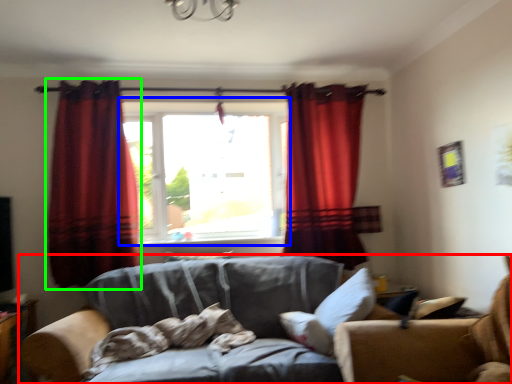
Question: Which is nearer to the studio couch (highlighted by a red box)? window (highlighted by a blue box) or curtain (highlighted by a green box).

Choices:
 (A) window
 (B) curtain

Answer: (A)